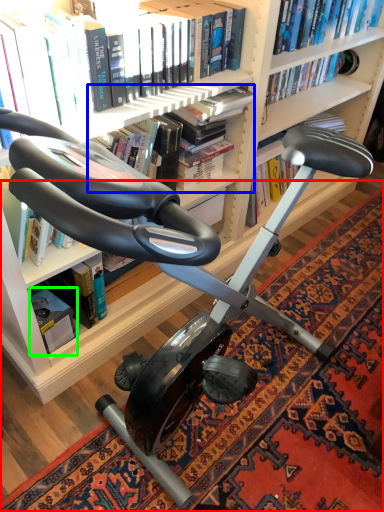
Question: Based on their relative distances, which object is farther from mat (highlighted by a red box)? Choose from book (highlighted by a blue box) and paperback book (highlighted by a green box).

Choices:
 (A) book
 (B) paperback book

Answer: (A)